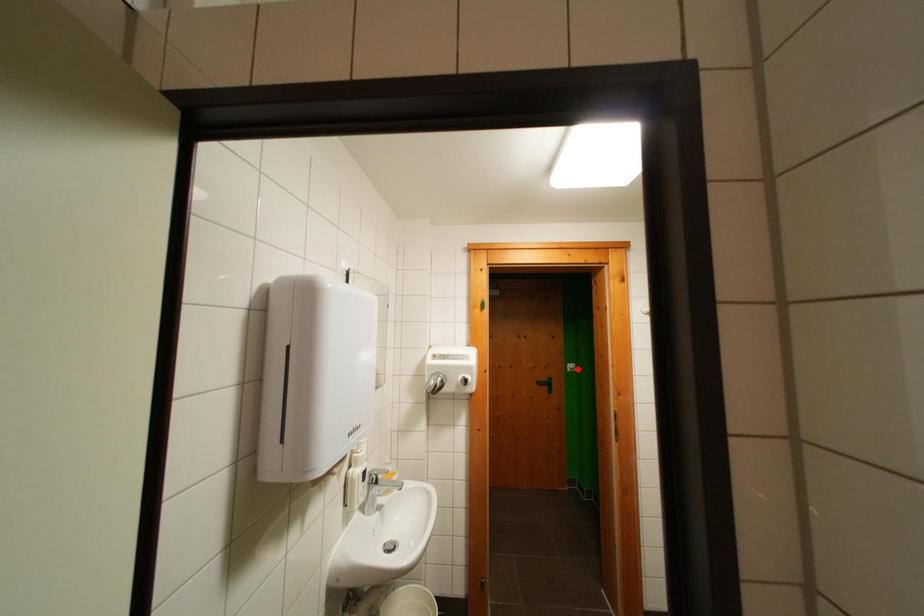
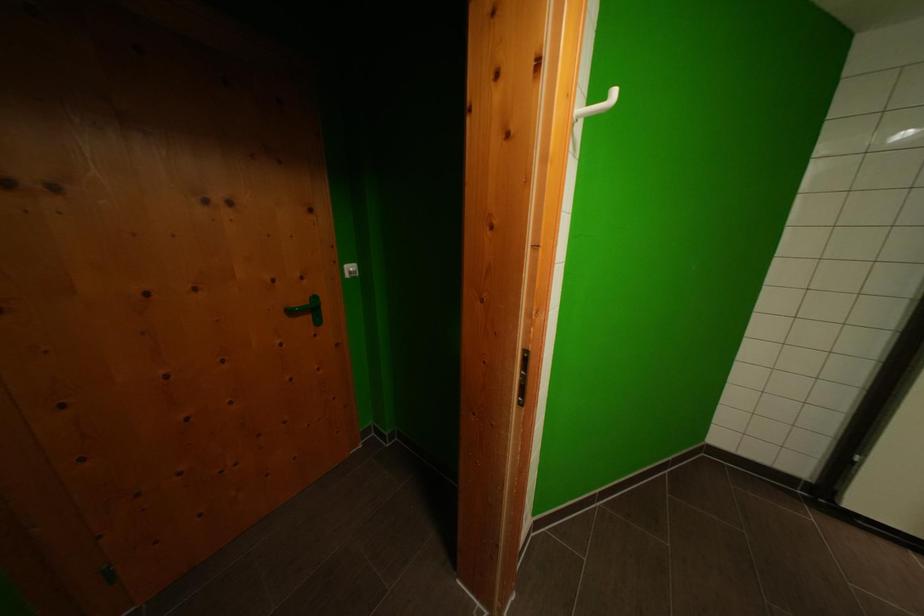
Question: I am providing you with two images of the same scene from different viewpoints. A red point is marked on the first image. Is the red point's position out of view in image 2?

Choices:
 (A) Yes
 (B) No

Answer: (B)